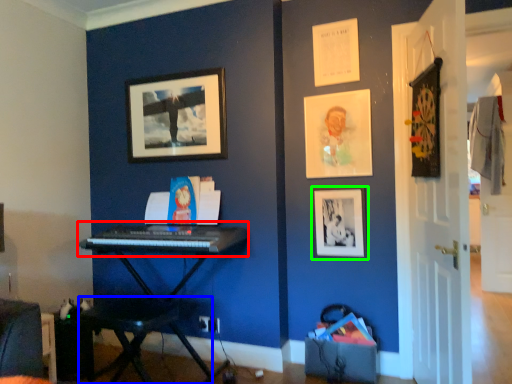
Question: Estimate the real-world distances between objects in this image. Which object is closer to musical keyboard (highlighted by a red box), table (highlighted by a blue box) or picture frame (highlighted by a green box)?

Choices:
 (A) table
 (B) picture frame

Answer: (A)